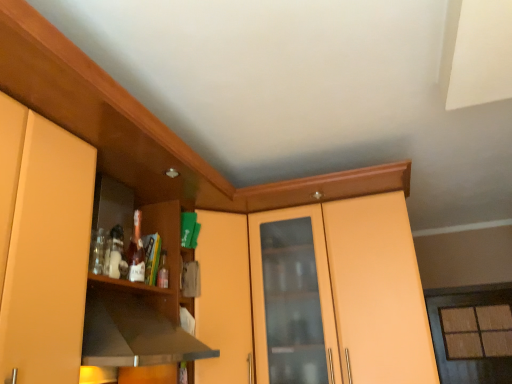
Question: Is matte glass window at right outside black matte exhaust hood at left?

Choices:
 (A) no
 (B) yes

Answer: (B)

Question: Does matte glass window at right have a larger size compared to black matte exhaust hood at left?

Choices:
 (A) yes
 (B) no

Answer: (A)

Question: Is matte glass window at right to the left of black matte exhaust hood at left from the viewer's perspective?

Choices:
 (A) yes
 (B) no

Answer: (B)

Question: Is matte glass window at right smaller than black matte exhaust hood at left?

Choices:
 (A) no
 (B) yes

Answer: (A)

Question: Is matte glass window at right taller than black matte exhaust hood at left?

Choices:
 (A) no
 (B) yes

Answer: (B)

Question: Based on their sizes in the image, would you say translucent glass bottle at shelf center is bigger or smaller than black matte exhaust hood at left?

Choices:
 (A) big
 (B) small

Answer: (B)

Question: Relative to black matte exhaust hood at left, is translucent glass bottle at shelf center in front or behind?

Choices:
 (A) front
 (B) behind

Answer: (B)

Question: Visually, is translucent glass bottle at shelf center positioned to the left or to the right of black matte exhaust hood at left?

Choices:
 (A) right
 (B) left

Answer: (A)

Question: Is point (166, 283) closer or farther from the camera than point (122, 334)?

Choices:
 (A) farther
 (B) closer

Answer: (A)

Question: Looking at their shapes, would you say matte yellow cabinet at left is wider or thinner than matte glass window at right?

Choices:
 (A) wide
 (B) thin

Answer: (A)

Question: Based on their sizes in the image, would you say matte yellow cabinet at left is bigger or smaller than matte glass window at right?

Choices:
 (A) big
 (B) small

Answer: (A)

Question: Does point (5, 175) appear closer or farther from the camera than point (473, 362)?

Choices:
 (A) farther
 (B) closer

Answer: (B)

Question: Is matte yellow cabinet at left in front of or behind matte glass window at right in the image?

Choices:
 (A) behind
 (B) front

Answer: (B)

Question: Considering their positions, is black matte exhaust hood at left located in front of or behind matte glass window at right?

Choices:
 (A) behind
 (B) front

Answer: (B)

Question: From their relative heights in the image, would you say black matte exhaust hood at left is taller or shorter than matte glass window at right?

Choices:
 (A) tall
 (B) short

Answer: (B)